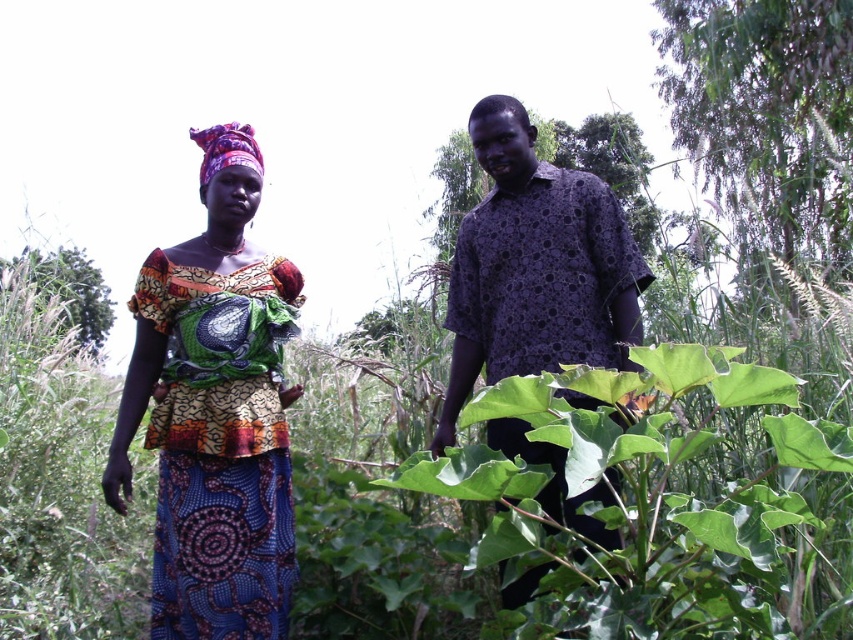
Is printed fabric dress at left above purple printed shirt at center?

Actually, printed fabric dress at left is below purple printed shirt at center.

Consider the image. Is printed fabric dress at left thinner than purple printed shirt at center?

Indeed, printed fabric dress at left has a lesser width compared to purple printed shirt at center.

Is point (113, 497) positioned before point (590, 353)?

Yes, point (113, 497) is in front of point (590, 353).

Identify the location of printed fabric dress at left. The width and height of the screenshot is (853, 640). (213, 412).

Which is in front, point (540, 611) or point (134, 378)?

Point (540, 611) is in front.

Does green leafy plant at center appear under printed fabric dress at left?

Yes, green leafy plant at center is below printed fabric dress at left.

Image resolution: width=853 pixels, height=640 pixels. Identify the location of green leafy plant at center. (645, 497).

Where is `green leafy plant at center`? green leafy plant at center is located at coordinates click(645, 497).

Can you confirm if green leafy plant at center is positioned to the left of purple printed shirt at center?

In fact, green leafy plant at center is to the right of purple printed shirt at center.

Is green leafy plant at center taller than purple printed shirt at center?

In fact, green leafy plant at center may be shorter than purple printed shirt at center.

Does point (589, 612) come farther from viewer compared to point (457, 324)?

No.

Locate an element on the screen. green leafy plant at center is located at coordinates (645, 497).